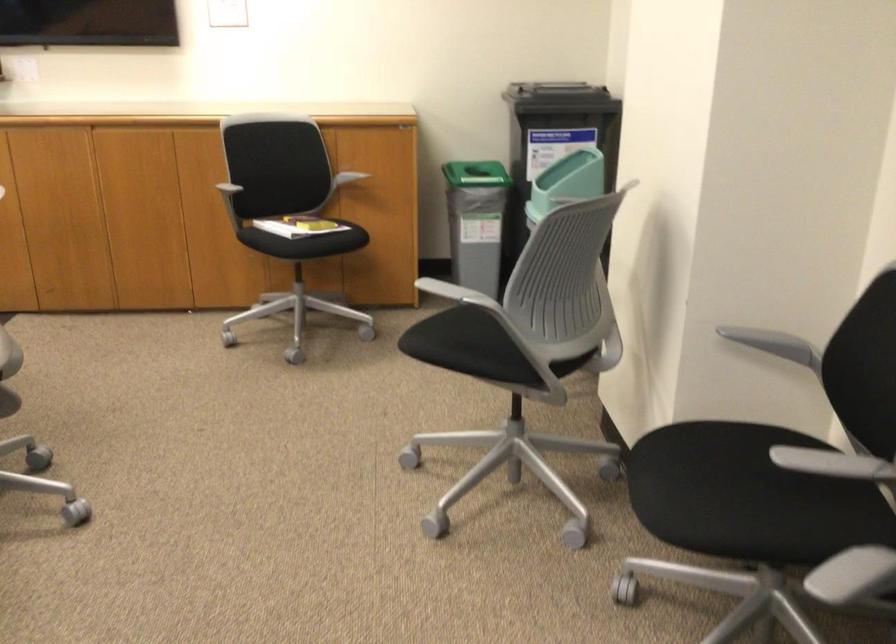
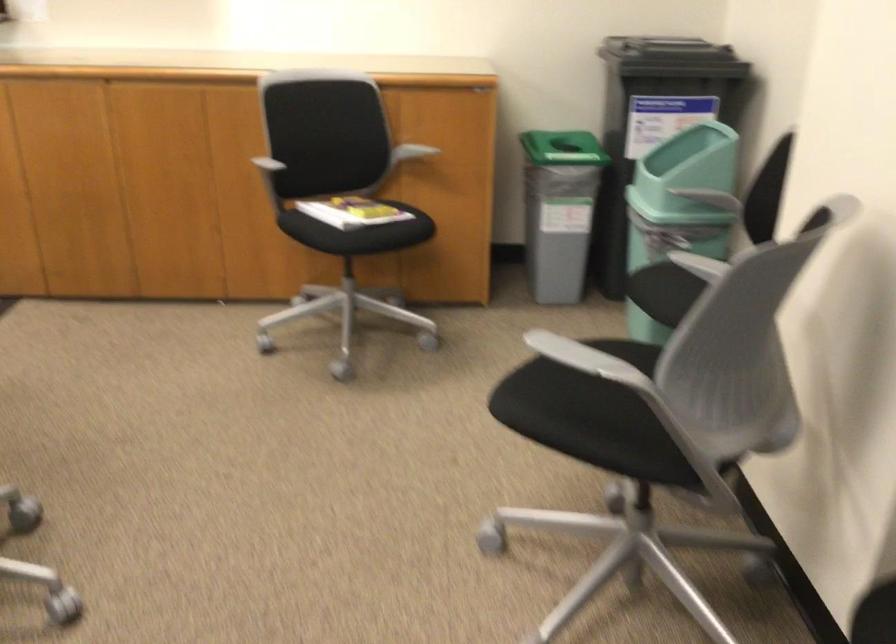
In the second image, find the point that corresponds to pixel 302 223 in the first image.

(355, 212)